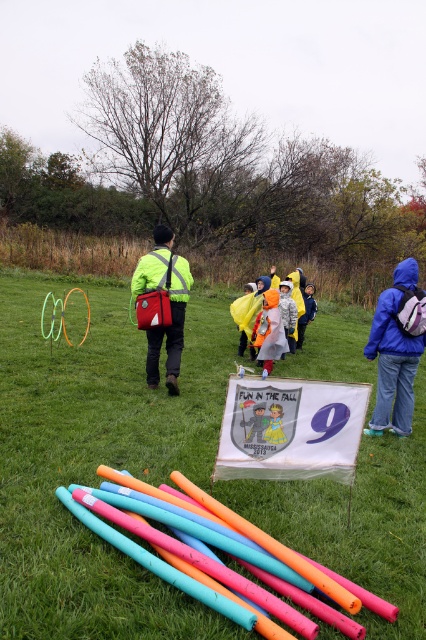
Question: Which object is positioned closest to the reflective neon green jacket at center?

Choices:
 (A) yellow fabric raincoat at center
 (B) matte yellow raincoat at center
 (C) orange raincoat at center

Answer: (C)

Question: Can you confirm if raincoat fabric at center is bigger than yellow fabric raincoat at center?

Choices:
 (A) no
 (B) yes

Answer: (B)

Question: In this image, where is green grass at center located relative to orange raincoat at center?

Choices:
 (A) left
 (B) right

Answer: (A)

Question: Considering the real-world distances, which object is farthest from the matte yellow raincoat at center?

Choices:
 (A) green grass at center
 (B) blue fleece jacket at right

Answer: (A)

Question: Where is matte plastic tubes at lower center located in relation to reflective neon green jacket at center in the image?

Choices:
 (A) left
 (B) right

Answer: (B)

Question: Which object is positioned closest to the green grass at center?

Choices:
 (A) raincoat fabric at center
 (B) yellow fabric raincoat at center

Answer: (A)